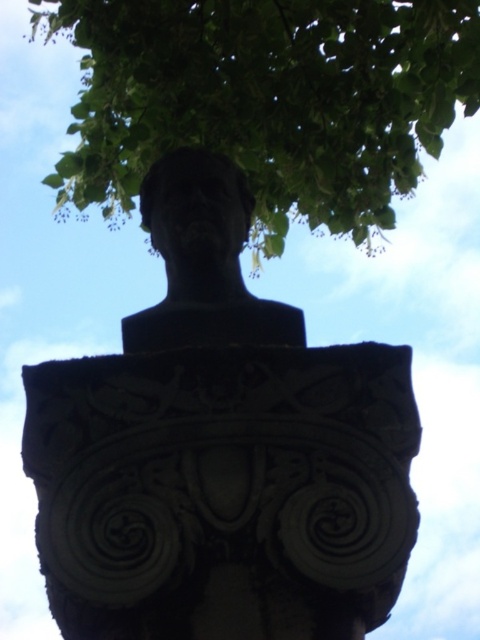
You are an artist standing in front of the sculpture and want to sketch the scene. Since the green leafy tree at upper center and the black stone bust at upper center are both in your view, which one is positioned higher in the image?

The green leafy tree at upper center is above the black stone bust at upper center, so it is positioned higher in the image.

You are standing in a park and see the black stone bust at center. If you want to take a photo of it, where should you position yourself relative to the sculpture to ensure it is fully visible without any obstruction from the tree branches above?

Since the black stone bust at center is positioned at point (219,451), you should position yourself in an area where the tree branches are not blocking the upper part of the sculpture. This might involve moving slightly to the left or right to find an angle where the foliage does not obscure the view.

You are an artist planning to paint the scene. You need to decide which object to focus on first based on their sizes. Which object should you paint first, the green leafy tree at upper center or the black stone bust at upper center?

The green leafy tree at upper center has a larger size compared to the black stone bust at upper center, so you should paint the green leafy tree at upper center first as it is bigger and might require more attention to detail.